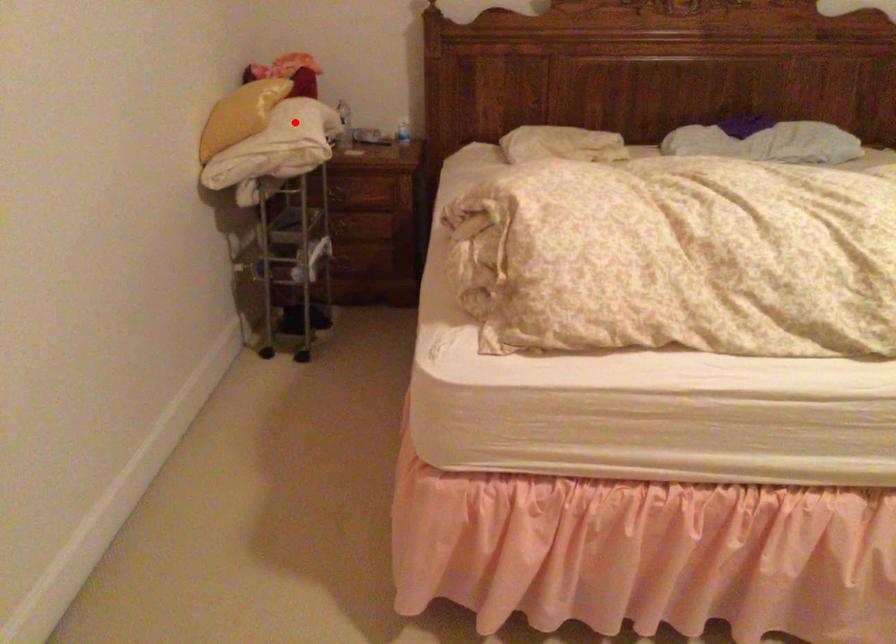
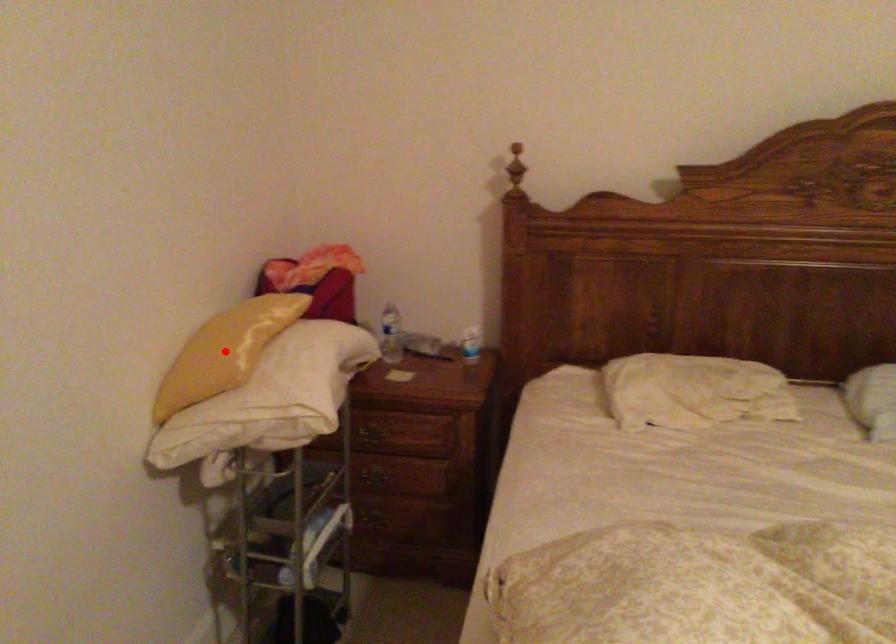
I am providing you with two images of the same scene from different viewpoints. A red point is marked on the first image and another point is marked on the second image. Does the point marked in image1 correspond to the same location as the one in image2?

No